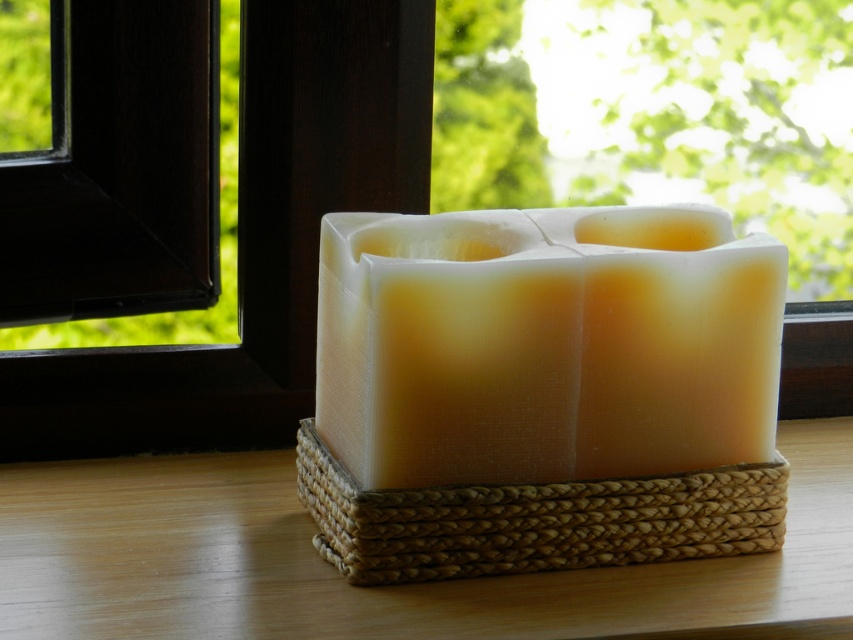
Is translucent wax candle at center thinner than wooden table at center?

Correct, translucent wax candle at center's width is less than wooden table at center's.

Who is higher up, translucent wax candle at center or wooden table at center?

translucent wax candle at center is higher up.

Is point (491, 465) positioned after point (332, 636)?

Yes, point (491, 465) is behind point (332, 636).

Locate an element on the screen. This screenshot has height=640, width=853. translucent wax candle at center is located at coordinates (544, 344).

Is point (289, 29) positioned before point (610, 451)?

No, it is behind (610, 451).

In order to click on transparent glass window at center in this screenshot , I will do `click(256, 241)`.

Can you confirm if translucent wax candle at center is smaller than woven straw basket at center?

No, translucent wax candle at center is not smaller than woven straw basket at center.

What do you see at coordinates (544, 344) in the screenshot? I see `translucent wax candle at center` at bounding box center [544, 344].

This screenshot has width=853, height=640. What are the coordinates of `translucent wax candle at center` in the screenshot? It's located at (544, 344).